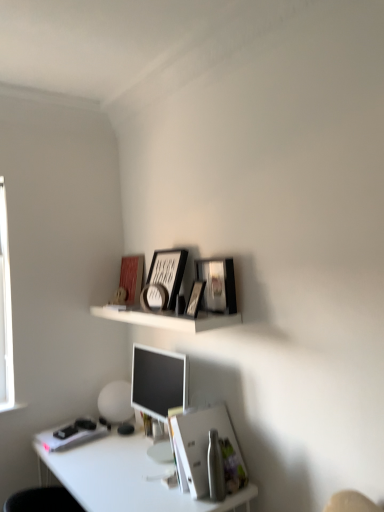
Where is `free location in front of white matte globe at lower left`? free location in front of white matte globe at lower left is located at coordinates (114, 437).